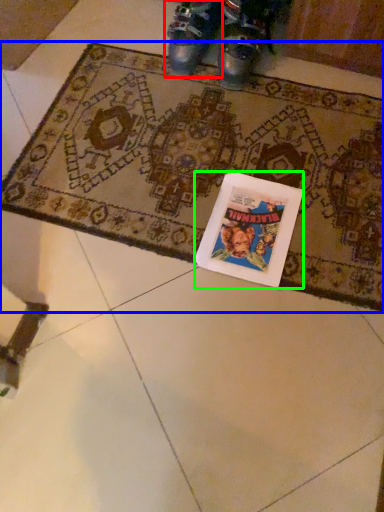
Question: Which object is positioned closest to footwear (highlighted by a red box)? Select from mat (highlighted by a blue box) and book cover (highlighted by a green box).

Choices:
 (A) mat
 (B) book cover

Answer: (A)